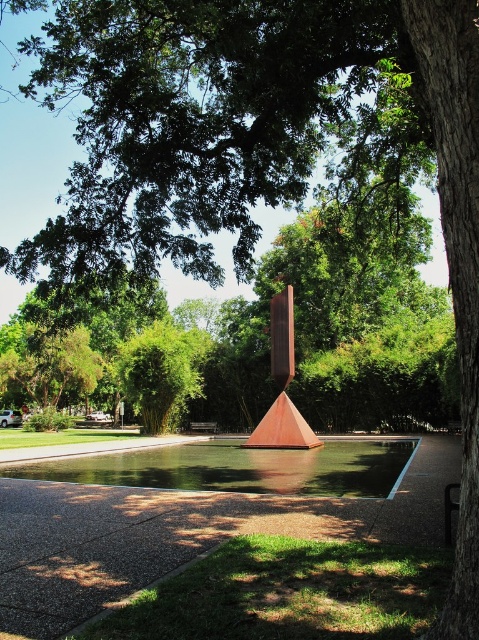
Question: Does green bamboo at center appear over rusty metal sculpture at center?

Choices:
 (A) yes
 (B) no

Answer: (A)

Question: Which object appears farthest from the camera in this image?

Choices:
 (A) green bamboo at center
 (B) rusty metal sculpture at center

Answer: (A)

Question: Can you confirm if green bamboo at center is smaller than rusty metal sculpture at center?

Choices:
 (A) yes
 (B) no

Answer: (B)

Question: Can you confirm if green bamboo at center is positioned above rusty metal sculpture at center?

Choices:
 (A) no
 (B) yes

Answer: (B)

Question: Which object is farther from the camera taking this photo?

Choices:
 (A) green bamboo at center
 (B) rusty metal sculpture at center

Answer: (A)